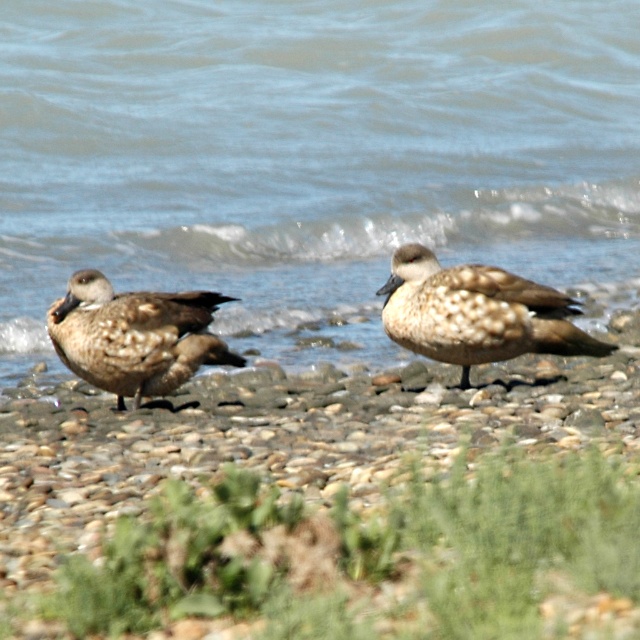
Which of these two, speckled feathered duck at center or brown speckled duck at left, stands shorter?

brown speckled duck at left

Which is more to the left, speckled feathered duck at center or brown speckled duck at left?

From the viewer's perspective, brown speckled duck at left appears more on the left side.

You are a GUI agent. You are given a task and a screenshot of the screen. Output one action in this format:
    pyautogui.click(x=<x>, y=<y>)
    Task: Click on the speckled feathered duck at center
    This screenshot has height=640, width=640.
    Given the screenshot: What is the action you would take?
    pyautogui.click(x=476, y=312)

Does blue water at center appear on the right side of speckled feathered duck at center?

In fact, blue water at center is to the left of speckled feathered duck at center.

Who is more forward, (397, 32) or (461, 269)?

Point (461, 269) is more forward.

Where is `blue water at center`? blue water at center is located at coordinates (310, 156).

Does blue water at center have a greater width compared to brown speckled duck at left?

Incorrect, blue water at center's width does not surpass brown speckled duck at left's.

Is blue water at center below brown speckled duck at left?

Yes, blue water at center is below brown speckled duck at left.

This screenshot has width=640, height=640. I want to click on blue water at center, so click(x=310, y=156).